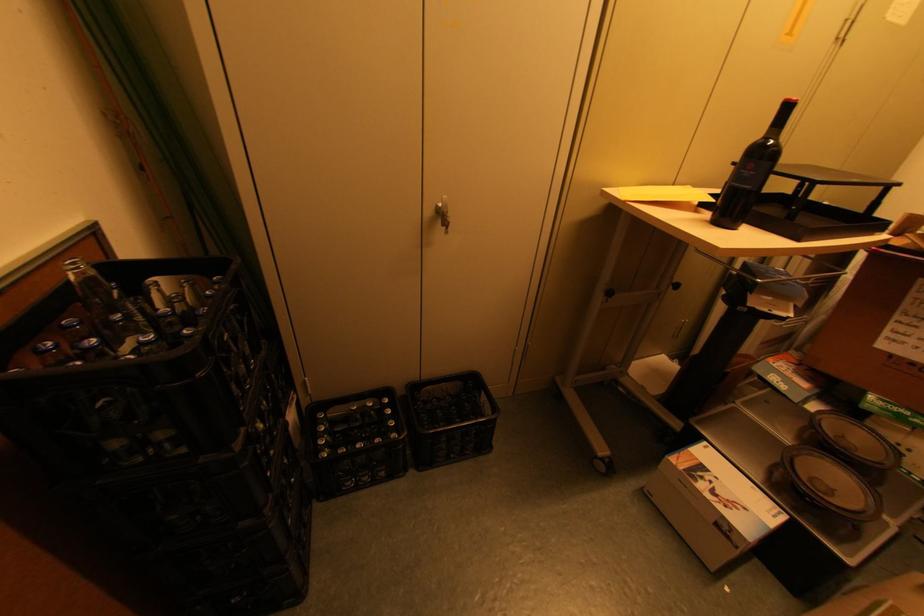
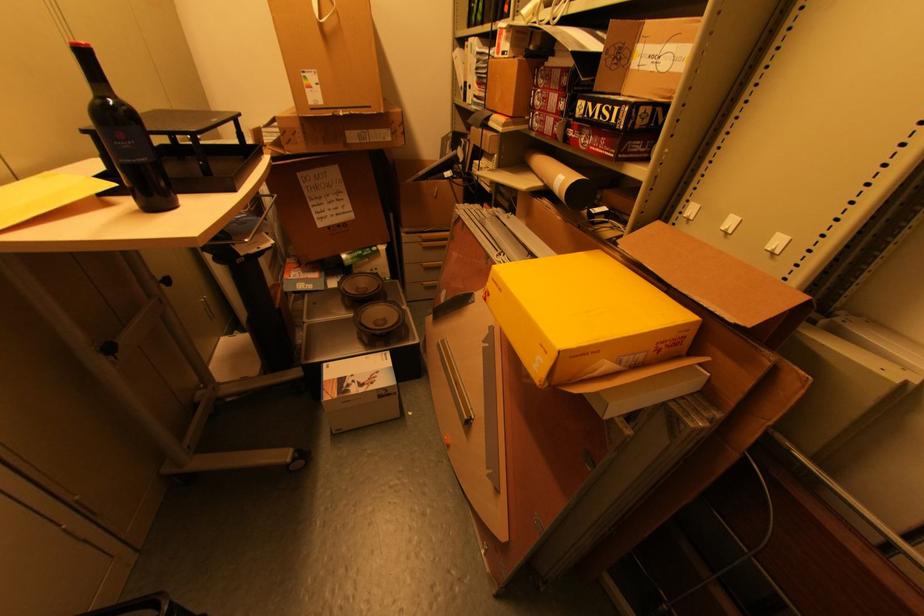
The point at (792,108) is marked in the first image. Where is the corresponding point in the second image?

(89, 55)